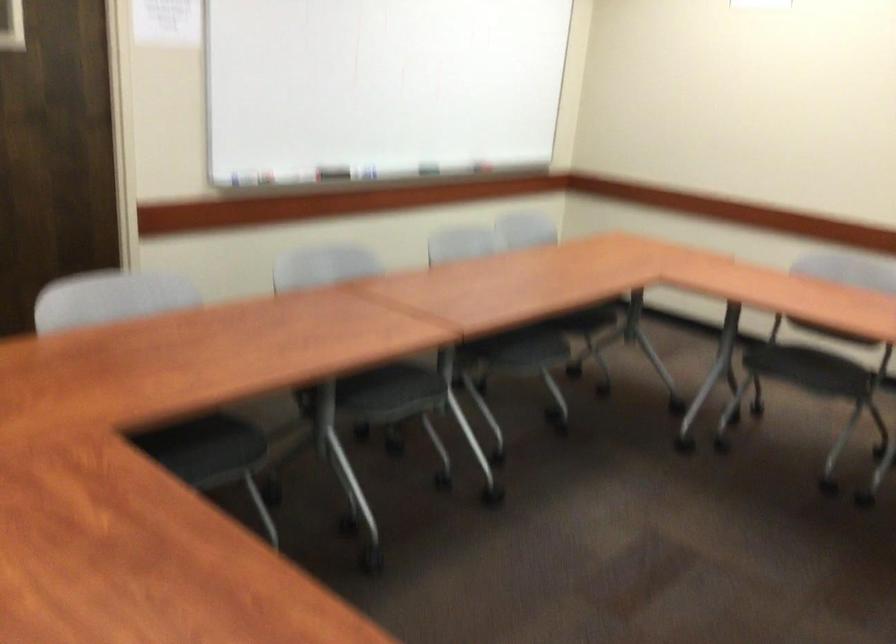
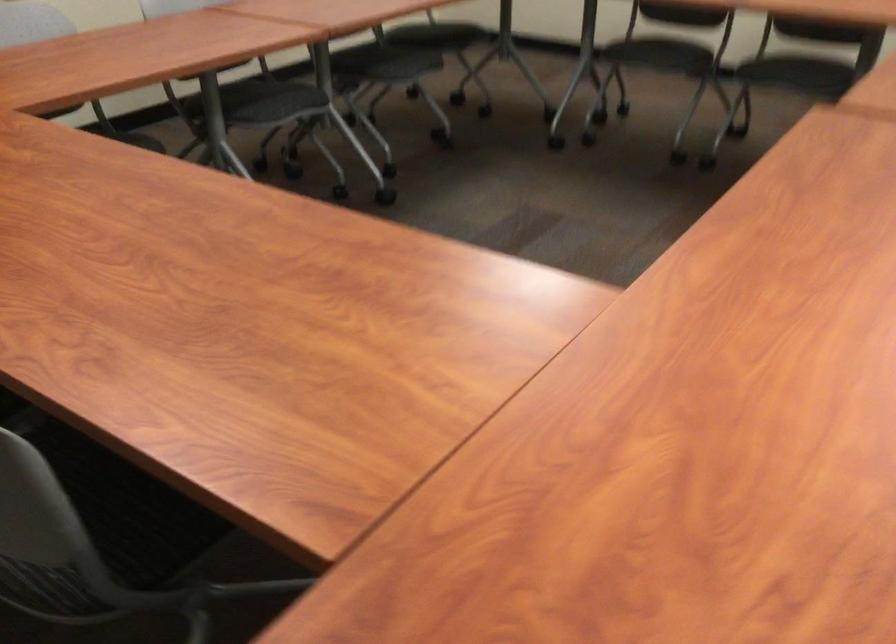
Question: The images are taken continuously from a first-person perspective. In which direction is your viewpoint rotating?

Choices:
 (A) Left
 (B) Right
 (C) Up
 (D) Down

Answer: (D)